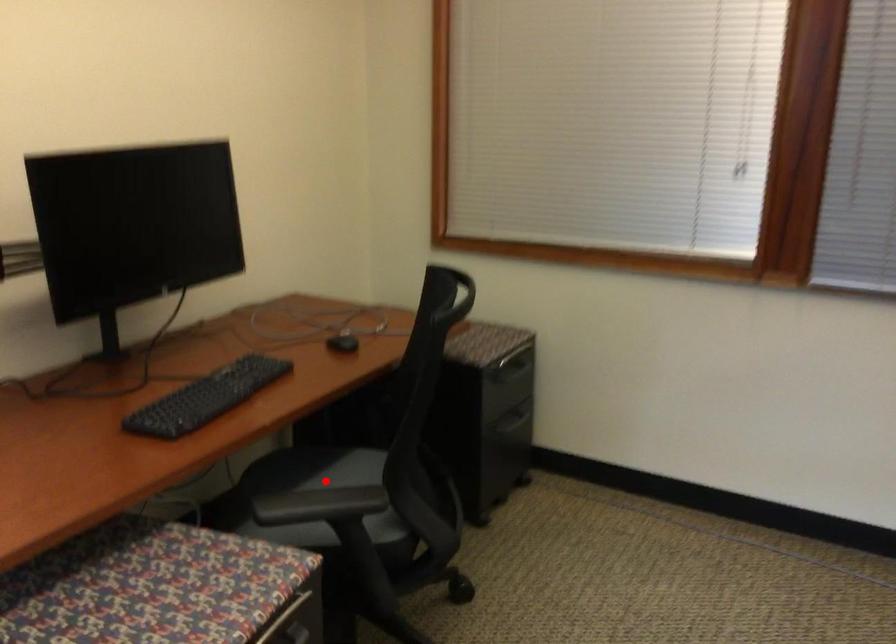
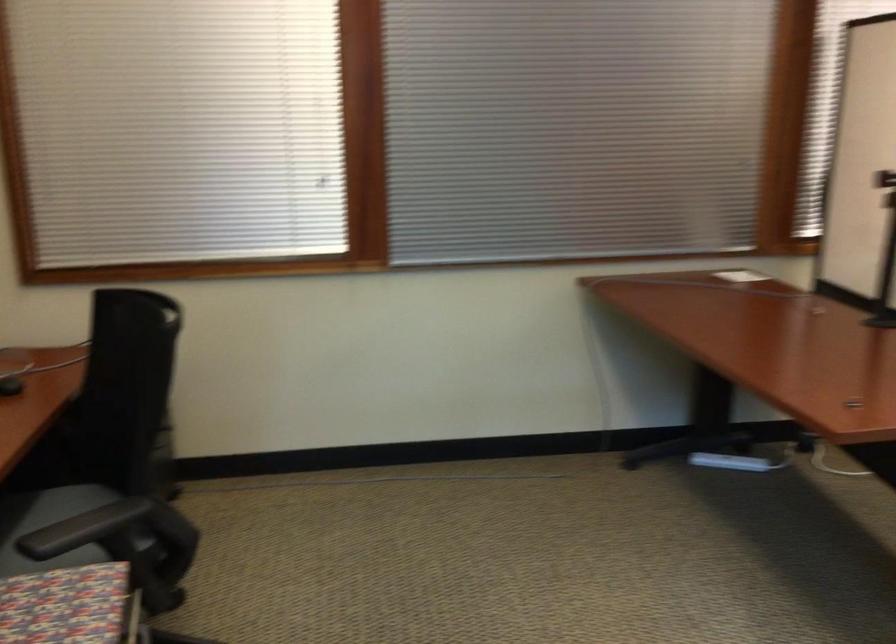
Question: I am providing you with two images of the same scene from different viewpoints. A red point is marked on the first image. Is the red point's position out of view in image 2?

Choices:
 (A) Yes
 (B) No

Answer: (B)